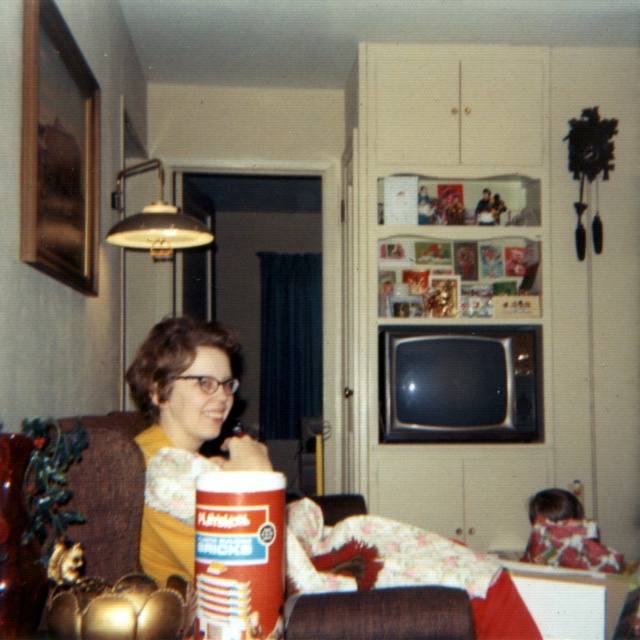
Question: Is matte yellow blouse at left above brown cardboard can at lower center?

Choices:
 (A) no
 (B) yes

Answer: (A)

Question: Can you confirm if matte yellow blouse at left is positioned above brown cardboard can at lower center?

Choices:
 (A) no
 (B) yes

Answer: (A)

Question: Which point is farther to the camera?

Choices:
 (A) (358, 580)
 (B) (204, 577)

Answer: (A)

Question: Is matte yellow blouse at left further to camera compared to brown cardboard can at lower center?

Choices:
 (A) yes
 (B) no

Answer: (A)

Question: Which of the following is the closest to the observer?

Choices:
 (A) matte yellow blouse at left
 (B) brown cardboard can at lower center

Answer: (B)